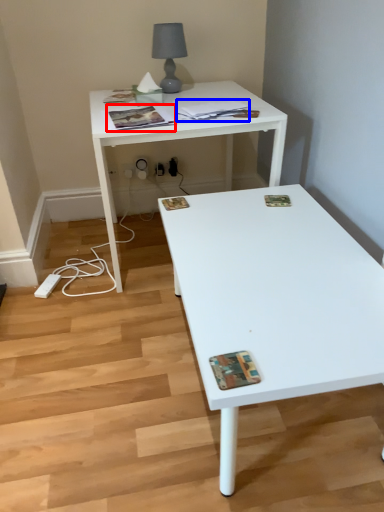
Question: Which object is closer to the camera taking this photo, magazine (highlighted by a red box) or magazine (highlighted by a blue box)?

Choices:
 (A) magazine
 (B) magazine

Answer: (A)